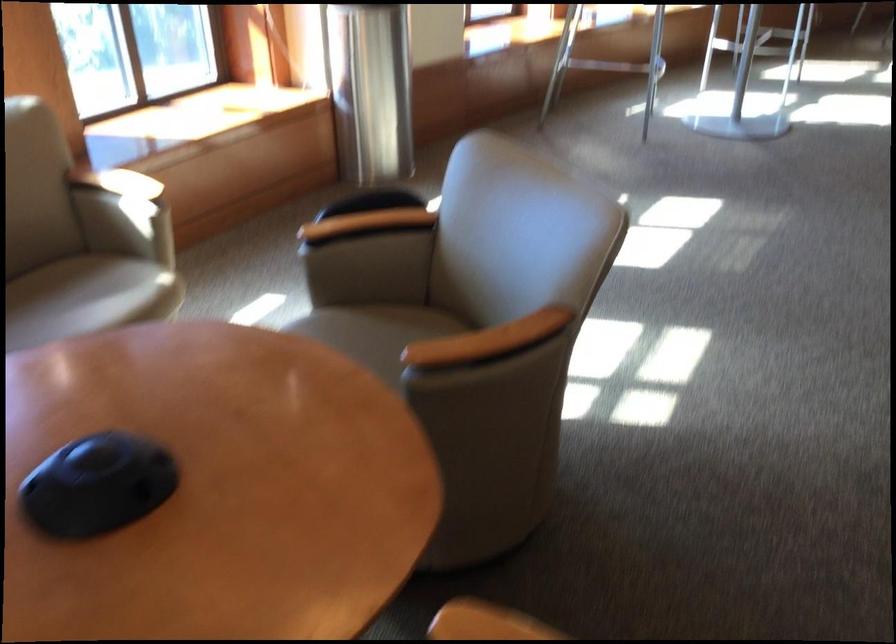
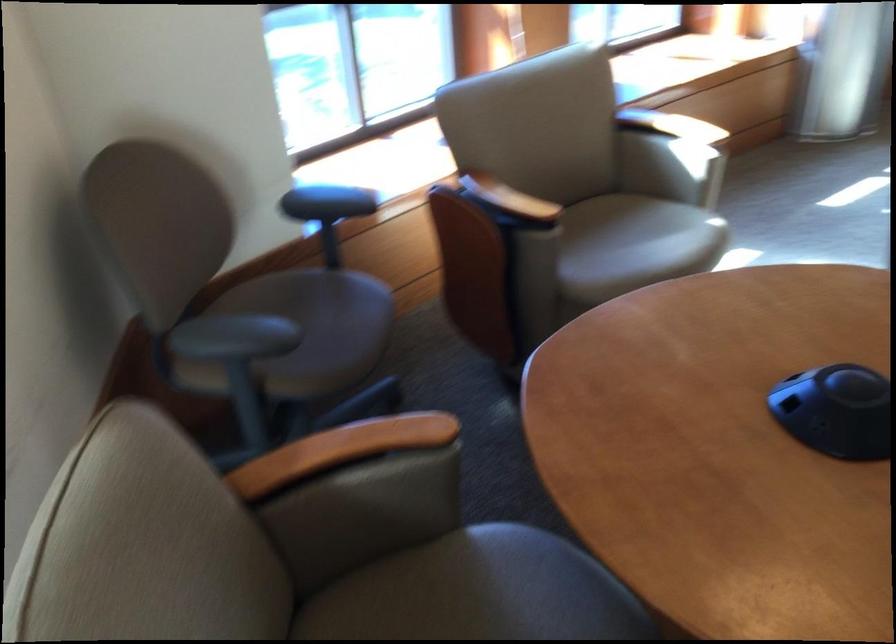
Find the pixel in the second image that matches point 69,313 in the first image.

(633, 245)